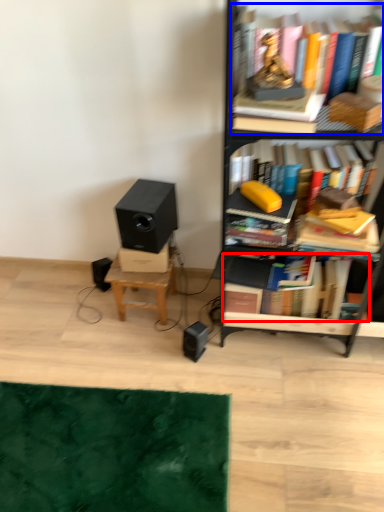
Question: Which object is further to the camera taking this photo, book (highlighted by a red box) or book (highlighted by a blue box)?

Choices:
 (A) book
 (B) book

Answer: (A)